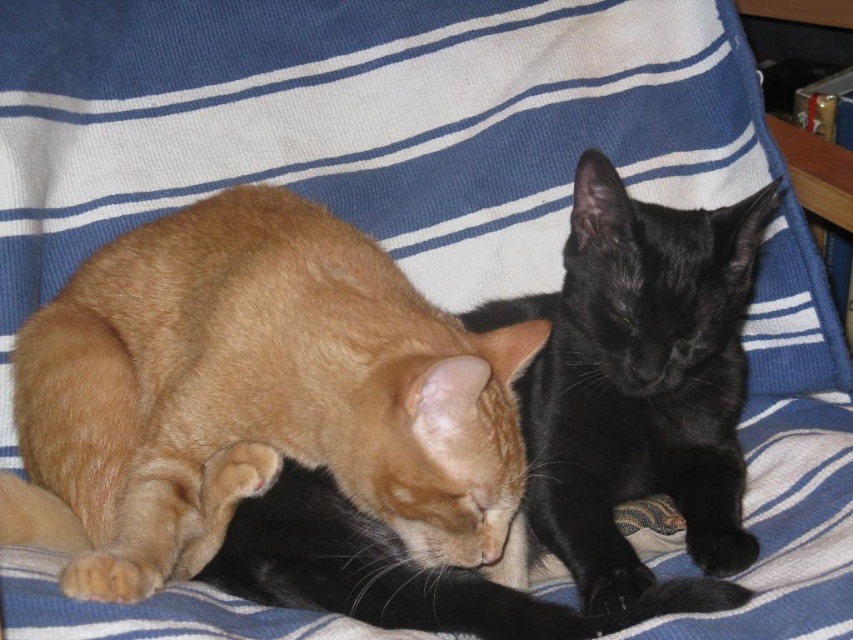
Does orange fur cat at center have a lesser width compared to black silky cat at center?

No, orange fur cat at center is not thinner than black silky cat at center.

Between orange fur cat at center and black silky cat at center, which one appears on the right side from the viewer's perspective?

black silky cat at center is more to the right.

You are a GUI agent. You are given a task and a screenshot of the screen. Output one action in this format:
    pyautogui.click(x=<x>, y=<y>)
    Task: Click on the orange fur cat at center
    The image size is (853, 640).
    Given the screenshot: What is the action you would take?
    pyautogui.click(x=253, y=396)